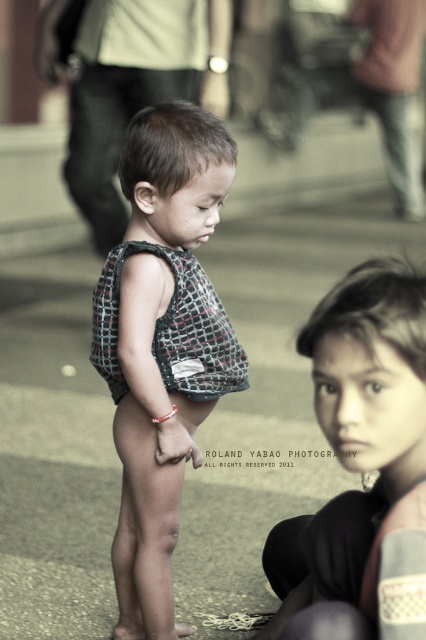
You are a delivery drone with a wingspan of 2 meters. You need to fly between the gray concrete pavement at center and the matte black tank top at center. Can you fit through the space between them?

The distance between the gray concrete pavement at center and the matte black tank top at center is 2.43 meters. Since your wingspan is 2 meters, you can safely fly through the space between them as the distance is greater than your wingspan.

You are a photographer trying to capture a closeup of the matte black tank top at center. Based on the scene, where should you position your camera relative to the gray concrete pavement at center?

The gray concrete pavement at center is located above the matte black tank top at center, so you should position your camera below the gray concrete pavement at center to capture the matte black tank top at center in a closeup.